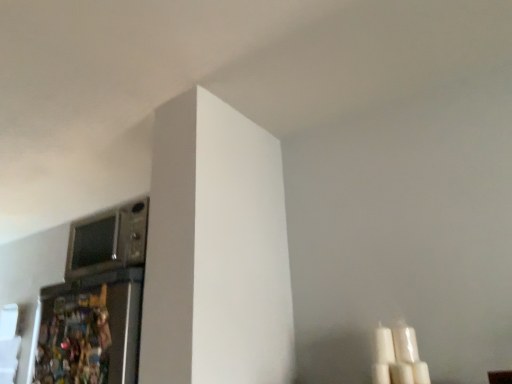
This screenshot has width=512, height=384. What do you see at coordinates (108, 240) in the screenshot? I see `satin silver microwave at upper left` at bounding box center [108, 240].

Measure the distance between satin silver microwave at upper left and camera.

satin silver microwave at upper left and camera are 5.31 feet apart from each other.

Locate an element on the screen. satin silver microwave at upper left is located at coordinates (108, 240).

Identify the location of satin silver microwave at upper left. This screenshot has height=384, width=512. (108, 240).